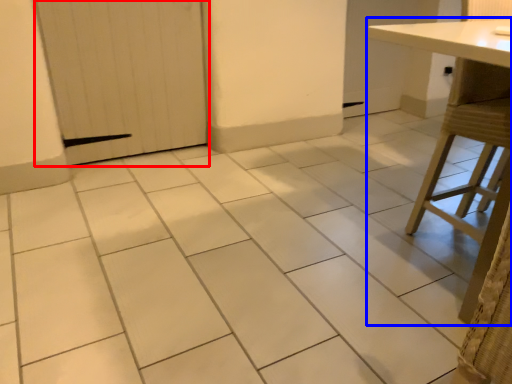
Question: Among these objects, which one is farthest to the camera, door (highlighted by a red box) or table (highlighted by a blue box)?

Choices:
 (A) door
 (B) table

Answer: (A)